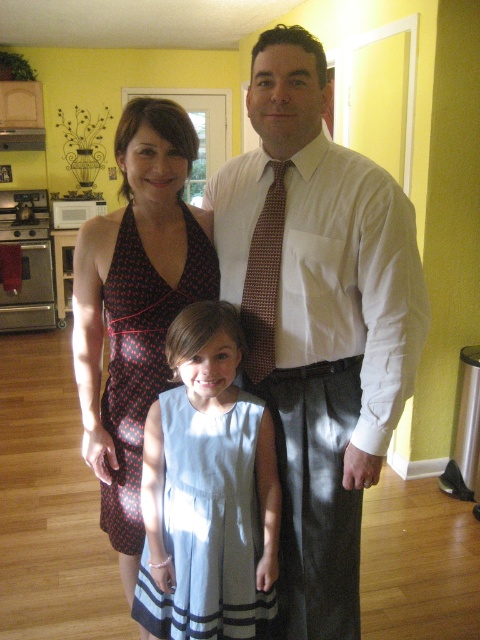
Question: Among these objects, which one is nearest to the camera?

Choices:
 (A) light blue cotton dress at center
 (B) white textured shirt at center
 (C) light blue fabric dress at center
 (D) brown dotted tie at center

Answer: (B)

Question: Which object is the farthest from the light blue fabric dress at center?

Choices:
 (A) white textured shirt at center
 (B) brown dotted tie at center
 (C) light blue cotton dress at center

Answer: (A)

Question: Can you confirm if light blue cotton dress at center is positioned above brown dotted tie at center?

Choices:
 (A) yes
 (B) no

Answer: (B)

Question: Is light blue cotton dress at center in front of brown dotted tie at center?

Choices:
 (A) yes
 (B) no

Answer: (A)

Question: Does white textured shirt at center appear on the right side of brown dotted tie at center?

Choices:
 (A) no
 (B) yes

Answer: (B)

Question: Considering the real-world distances, which object is farthest from the white textured shirt at center?

Choices:
 (A) light blue cotton dress at center
 (B) brown dotted tie at center
 (C) light blue fabric dress at center

Answer: (C)